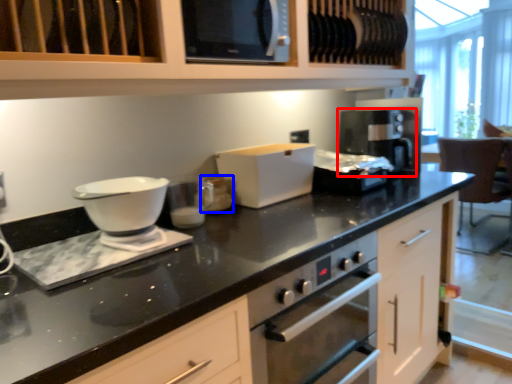
Question: Which point is closer to the camera, coffee machine (highlighted by a red box) or appliance (highlighted by a blue box)?

Choices:
 (A) coffee machine
 (B) appliance

Answer: (B)